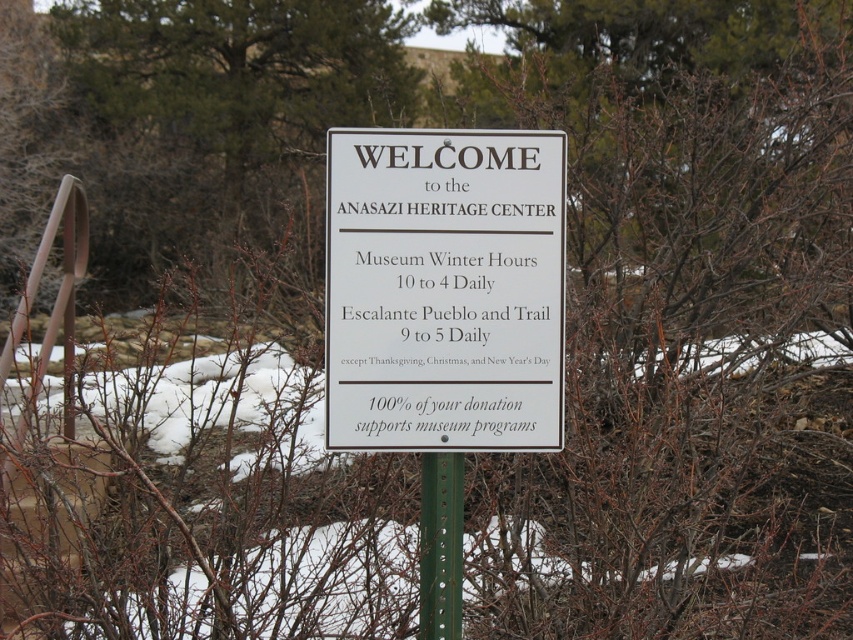
Question: Does white plastic sign at center lie behind green metallic post at center?

Choices:
 (A) yes
 (B) no

Answer: (B)

Question: Which point is closer to the camera?

Choices:
 (A) (451, 524)
 (B) (514, 371)

Answer: (B)

Question: Which object is farther from the camera taking this photo?

Choices:
 (A) white plastic sign at center
 (B) green metallic post at center

Answer: (B)

Question: Does white plastic sign at center have a lesser width compared to green metallic post at center?

Choices:
 (A) no
 (B) yes

Answer: (A)

Question: Which point is farther from the camera taking this photo?

Choices:
 (A) (456, 579)
 (B) (389, 337)

Answer: (A)

Question: Does white plastic sign at center appear on the left side of green metallic post at center?

Choices:
 (A) yes
 (B) no

Answer: (B)